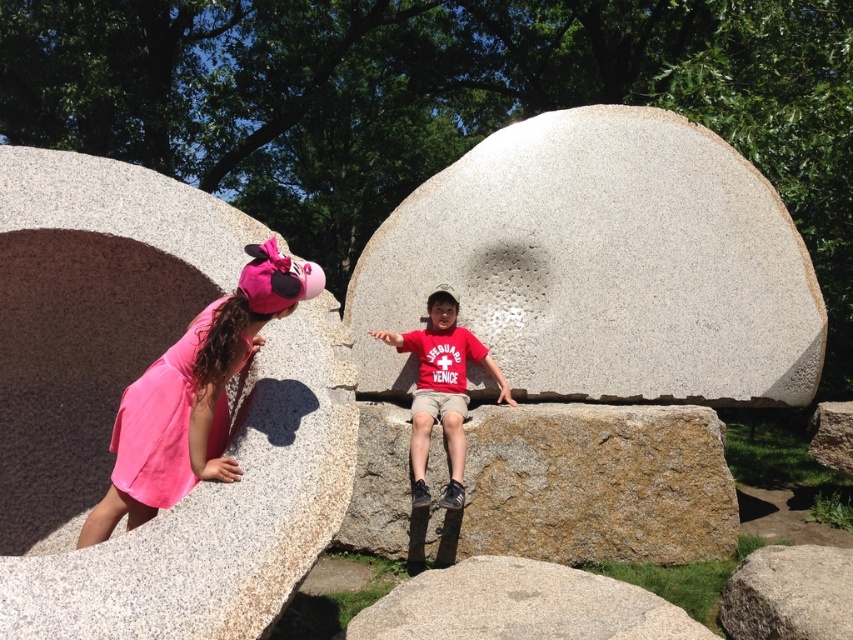
Based on the scene description, where is the gray granite stone at center located in terms of its 2D coordinates?

The gray granite stone at center is located at the 2D coordinates of point (601, 266).

Based on the photo, you are a parent supervising the children in the park. You notice the gray granite stone at center and the brown rough stone at center. Which stone is positioned closer to you?

The gray granite stone at center is closer to you because the brown rough stone at center is behind it.

You are a parent supervising two children playing near the granite boulder at left and the gray granite rock at center. You need to place a safety mat that can cover the entire width of both objects. Which object requires a wider mat?

The granite boulder at left requires a wider mat because its width is larger than the gray granite rock at center.